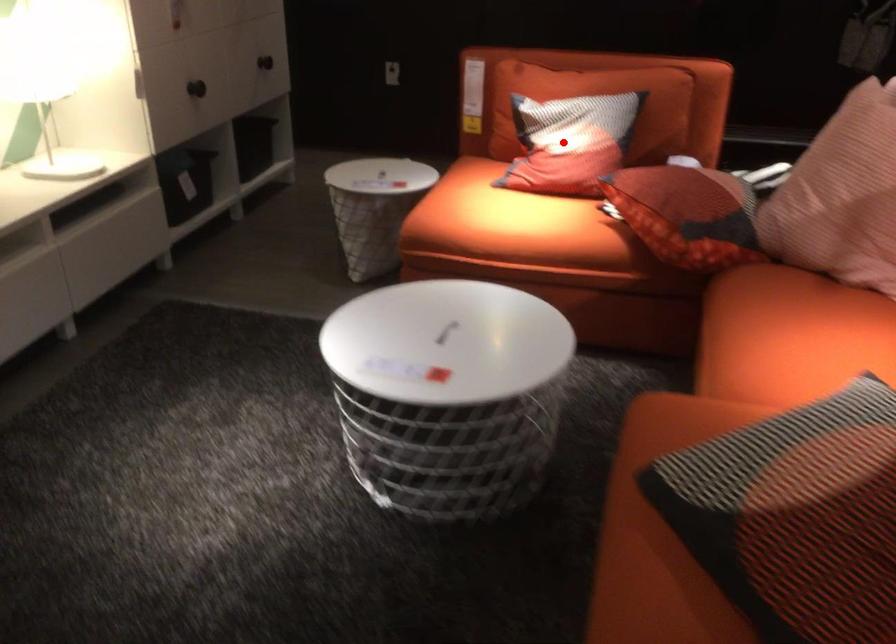
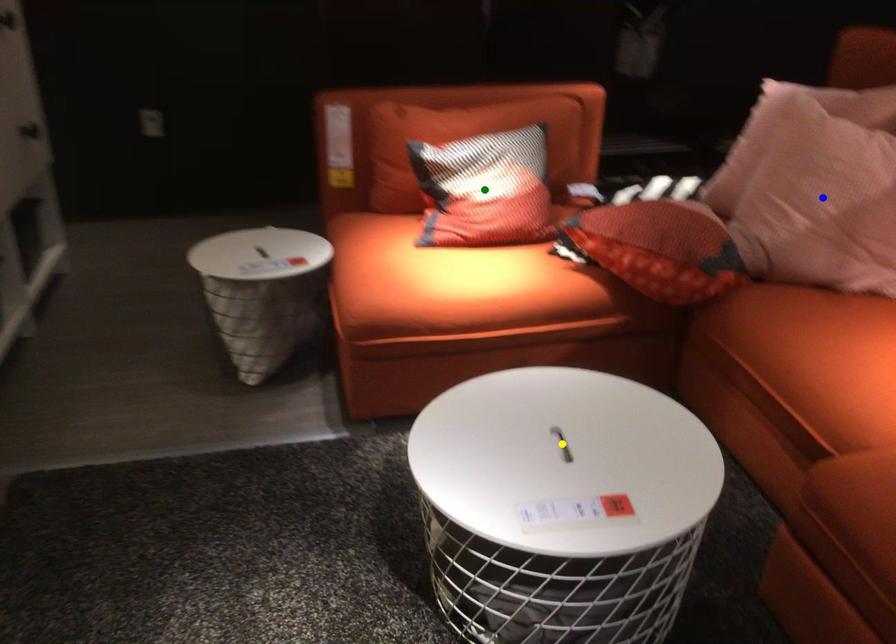
Question: I am providing you with two images of the same scene from different viewpoints. A red point is marked on the first image. You are given multiple points on the second image. Which point in image 2 represents the same 3d spot as the red point in image 1?

Choices:
 (A) green point
 (B) yellow point
 (C) blue point

Answer: (A)